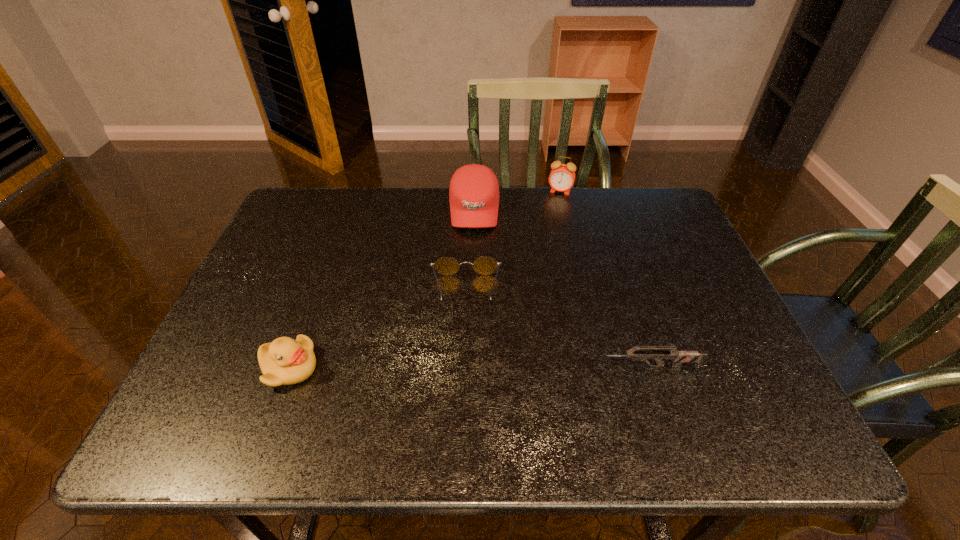
Identify the location of alarm clock that is at the far edge. (562, 177).

Identify the location of duckling that is positioned at the near edge. (285, 361).

In order to click on gun present at the near edge in this screenshot , I will do `click(679, 357)`.

The width and height of the screenshot is (960, 540). Identify the location of object situated at the left edge. (285, 361).

The width and height of the screenshot is (960, 540). I want to click on object positioned at the right edge, so click(679, 357).

This screenshot has width=960, height=540. I want to click on object that is at the near left corner, so click(x=285, y=361).

Locate an element on the screen. object that is positioned at the near right corner is located at coordinates (679, 357).

The width and height of the screenshot is (960, 540). Find the location of `free space at the far edge of the desktop`. free space at the far edge of the desktop is located at coordinates (611, 217).

I want to click on vacant area at the near edge, so click(x=490, y=379).

Find the location of a particular element. vacant space at the left edge is located at coordinates (242, 300).